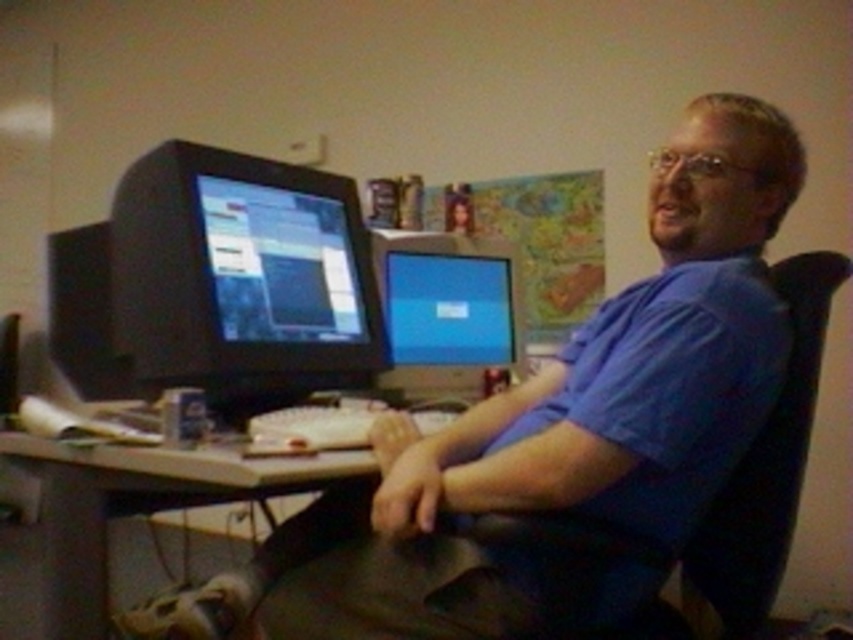
Please describe the exact location of the blue matte shirt at center in the image using coordinates.

The blue matte shirt at center is located at coordinates point (554, 436).

You are a delivery person who needs to place a package on the desk without blocking either of the two matte black monitors. Given that the package is 15 cm thick, can you determine if there is enough space between the matte black monitor at left and the matte black monitor at center to place the package?

The matte black monitor at left is in front of the matte black monitor at center, so there is space between them. The package is 15 cm thick, so you can place it between the two monitors without blocking them.

You are a delivery person who just arrived at this office. You need to place a new keyboard that measures 12 inches in length on the desk. The wooden desk at center has enough space. However, you must ensure that the keyboard is placed at least 12 inches away from the matte black monitor at center to avoid blocking its view. Can you fit the keyboard in the available space?

The wooden desk at center and matte black monitor at center are 25.56 inches apart. Since the keyboard is 12 inches long and needs to be at least 12 inches away from the matte black monitor at center, there is sufficient space as 12 inches plus the keyboard length equals 24 inches, which is less than the 25.56 inches available. Therefore, the keyboard can be placed without blocking the monitor.